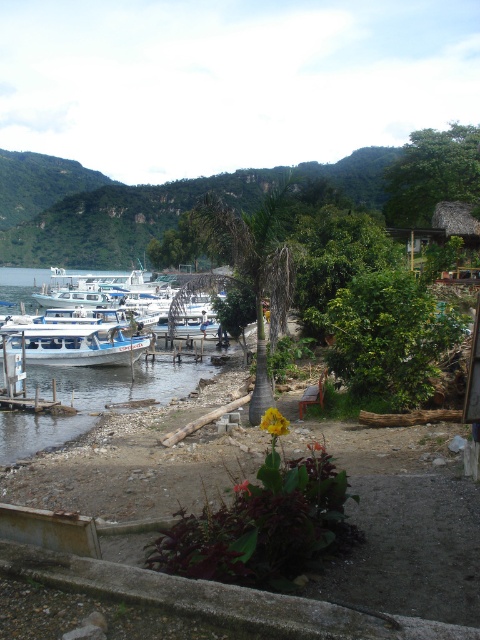
Question: Can you confirm if white glossy boat at lower left is positioned below wooden bench at lower center?

Choices:
 (A) yes
 (B) no

Answer: (B)

Question: Is white glossy boat at lower left in front of wooden bench at lower center?

Choices:
 (A) no
 (B) yes

Answer: (A)

Question: Which of the following is the farthest from the observer?

Choices:
 (A) (143, 337)
 (B) (320, 394)

Answer: (A)

Question: Can you confirm if white glossy boat at lower left is wider than wooden bench at lower center?

Choices:
 (A) no
 (B) yes

Answer: (A)